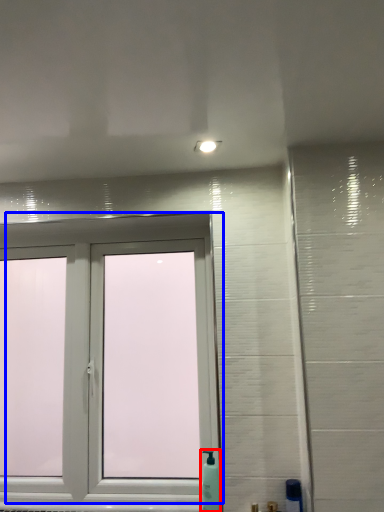
Question: Which of the following is the closest to the observer, soap dispenser (highlighted by a red box) or window (highlighted by a blue box)?

Choices:
 (A) soap dispenser
 (B) window

Answer: (A)